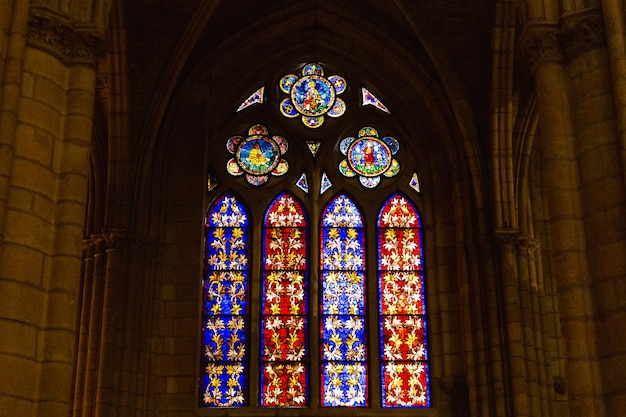
This screenshot has width=626, height=417. I want to click on tips of long windows, so click(x=398, y=193), click(x=341, y=192), click(x=284, y=191), click(x=230, y=191).